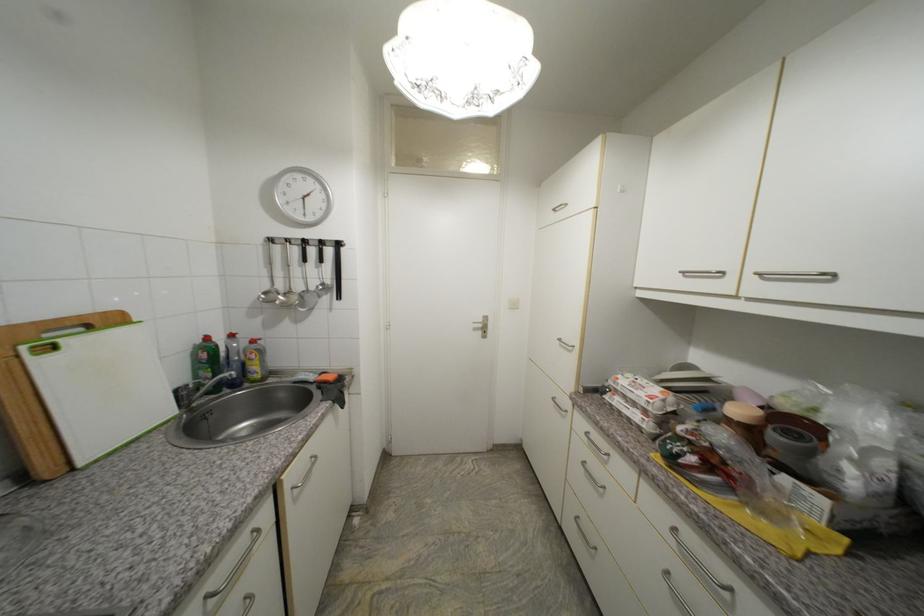
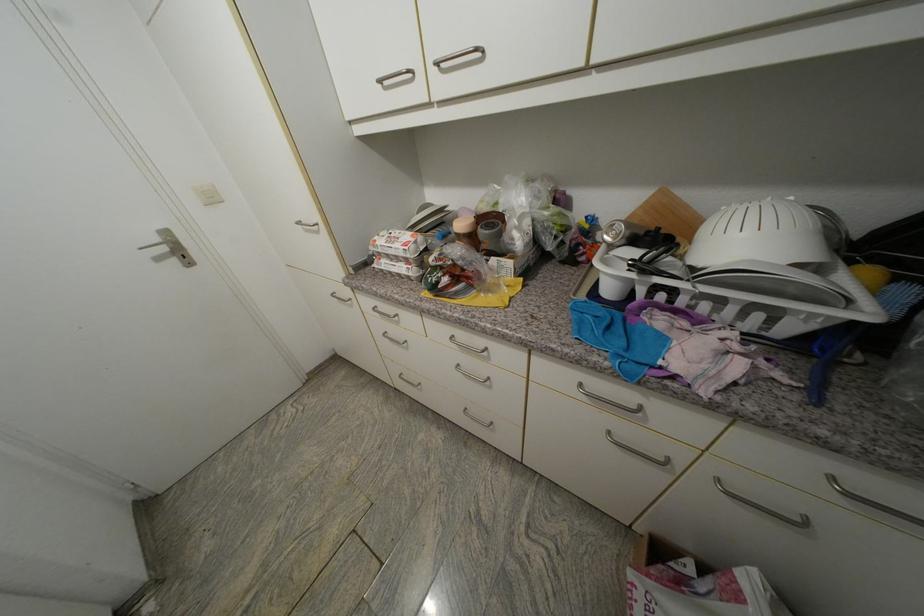
Based on the continuous images, in which direction is the camera rotating?

The rotation direction of the camera is right-down.